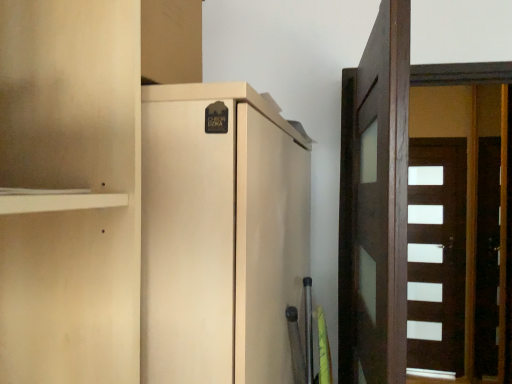
Question: Does matte beige cupboard at center have a larger size compared to dark brown wood door at right, placed as the first door when sorted from front to back?

Choices:
 (A) yes
 (B) no

Answer: (A)

Question: Is matte beige cupboard at center to the left of dark brown wood door at right, acting as the 2th door starting from the back, from the viewer's perspective?

Choices:
 (A) no
 (B) yes

Answer: (B)

Question: Can you confirm if matte beige cupboard at center is smaller than dark brown wood door at right, placed as the first door when sorted from front to back?

Choices:
 (A) no
 (B) yes

Answer: (A)

Question: From a real-world perspective, is matte beige cupboard at center below dark brown wood door at right, the first door from the left?

Choices:
 (A) yes
 (B) no

Answer: (A)

Question: Could dark brown wood door at right, acting as the 2th door starting from the back, be considered to be inside matte beige cupboard at center?

Choices:
 (A) yes
 (B) no

Answer: (B)

Question: Based on their positions, is matte beige cupboard at center located to the left or right of white glossy door at right, the 1th door in the right-to-left sequence?

Choices:
 (A) left
 (B) right

Answer: (A)

Question: From a real-world perspective, is matte beige cupboard at center above or below white glossy door at right, the 2th door in the front-to-back sequence?

Choices:
 (A) below
 (B) above

Answer: (B)

Question: Do you think matte beige cupboard at center is within white glossy door at right, which ranks as the second door in left-to-right order, or outside of it?

Choices:
 (A) outside
 (B) inside

Answer: (A)

Question: Is point (279, 253) closer or farther from the camera than point (435, 148)?

Choices:
 (A) farther
 (B) closer

Answer: (B)

Question: From their relative heights in the image, would you say matte beige cupboard at center is taller or shorter than dark brown wood door at right, acting as the 2th door starting from the back?

Choices:
 (A) tall
 (B) short

Answer: (B)

Question: In terms of size, does matte beige cupboard at center appear bigger or smaller than dark brown wood door at right, acting as the 2th door starting from the back?

Choices:
 (A) big
 (B) small

Answer: (A)

Question: Relative to dark brown wood door at right, the first door from the left, is matte beige cupboard at center in front or behind?

Choices:
 (A) behind
 (B) front

Answer: (B)

Question: Do you think matte beige cupboard at center is within dark brown wood door at right, which is the second door from right to left, or outside of it?

Choices:
 (A) outside
 (B) inside

Answer: (A)

Question: From a real-world perspective, is white glossy door at right, the 2th door in the front-to-back sequence, above or below dark brown wood door at right, placed as the first door when sorted from front to back?

Choices:
 (A) below
 (B) above

Answer: (A)

Question: In terms of width, does white glossy door at right, acting as the first door starting from the back, look wider or thinner when compared to dark brown wood door at right, acting as the 2th door starting from the back?

Choices:
 (A) thin
 (B) wide

Answer: (A)